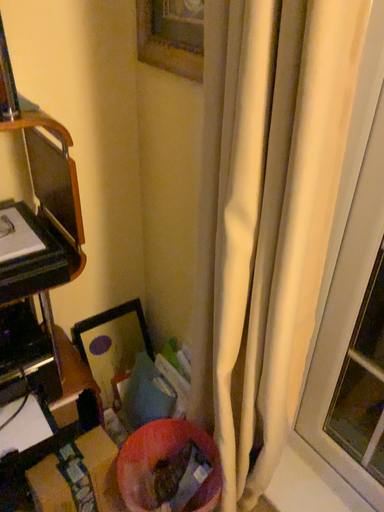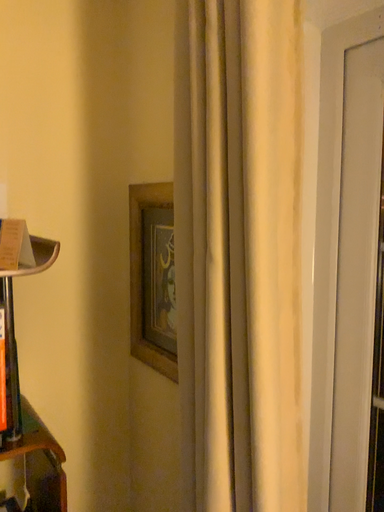
Question: Which way did the camera rotate in the video?

Choices:
 (A) rotated downward
 (B) rotated upward

Answer: (B)